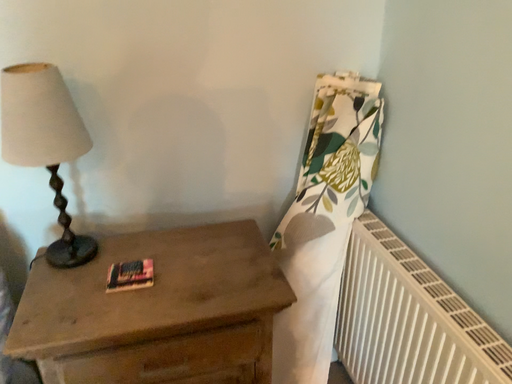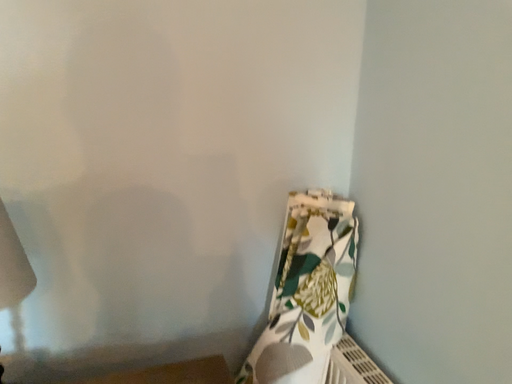
Question: Which way did the camera rotate in the video?

Choices:
 (A) rotated upward
 (B) rotated downward

Answer: (A)